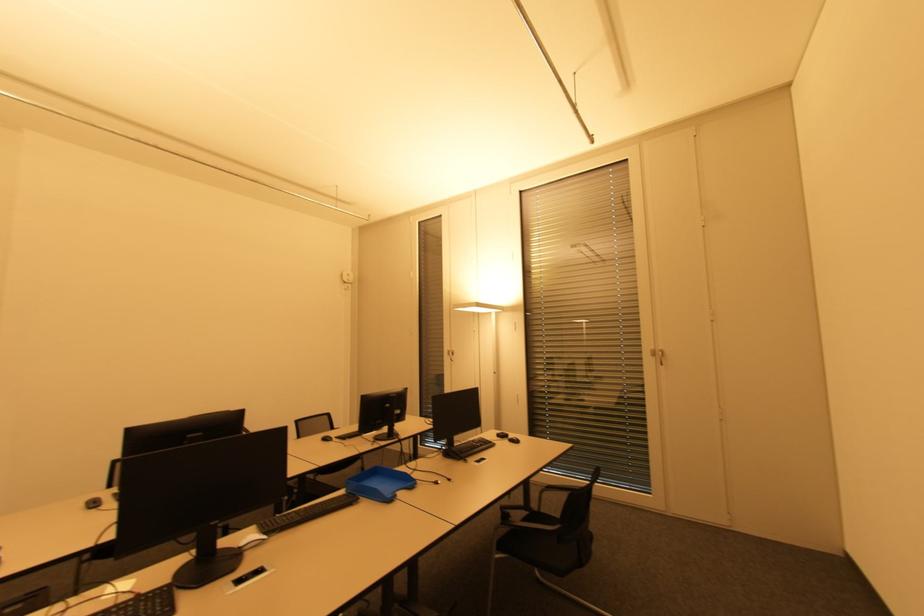
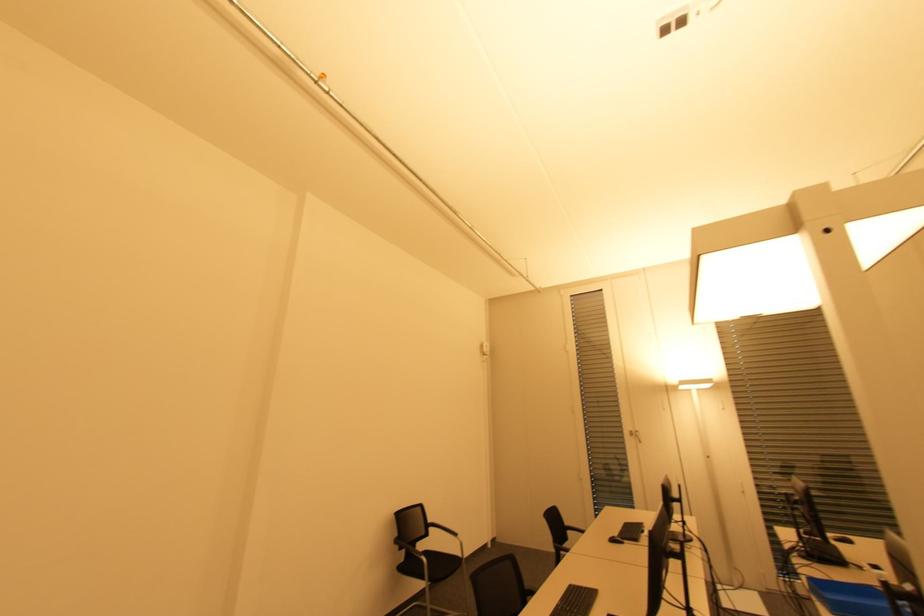
Question: What movement of the cameraman would produce the second image?

Choices:
 (A) Left
 (B) Right
 (C) Forward
 (D) Backward

Answer: (A)